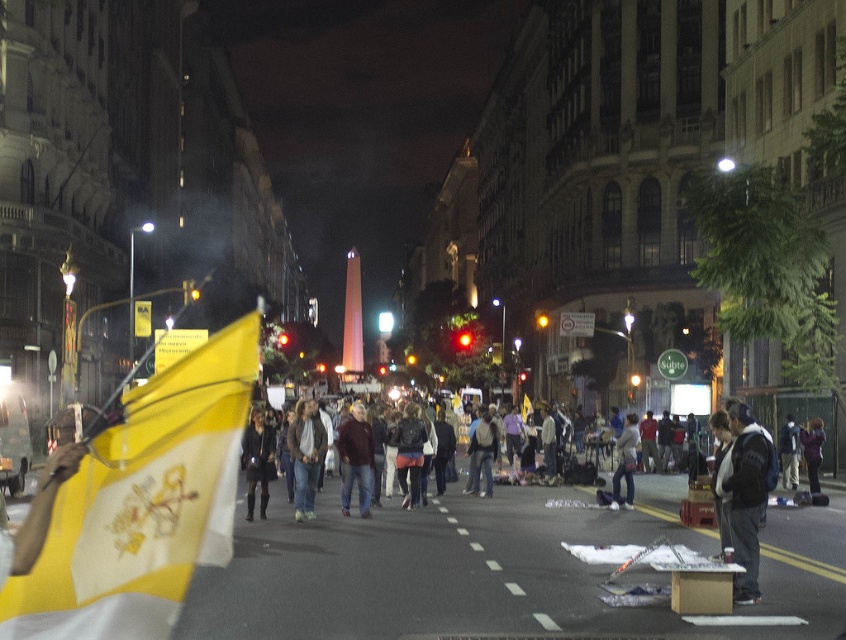
You are a photographer standing in the middle of the bustling urban street scene. You notice two people in the middle ground wearing a dark fabric coat at center and dark blue jeans at center. Which clothing item appears smaller in the image?

The dark fabric coat at center appears smaller compared to the dark blue jeans at center.